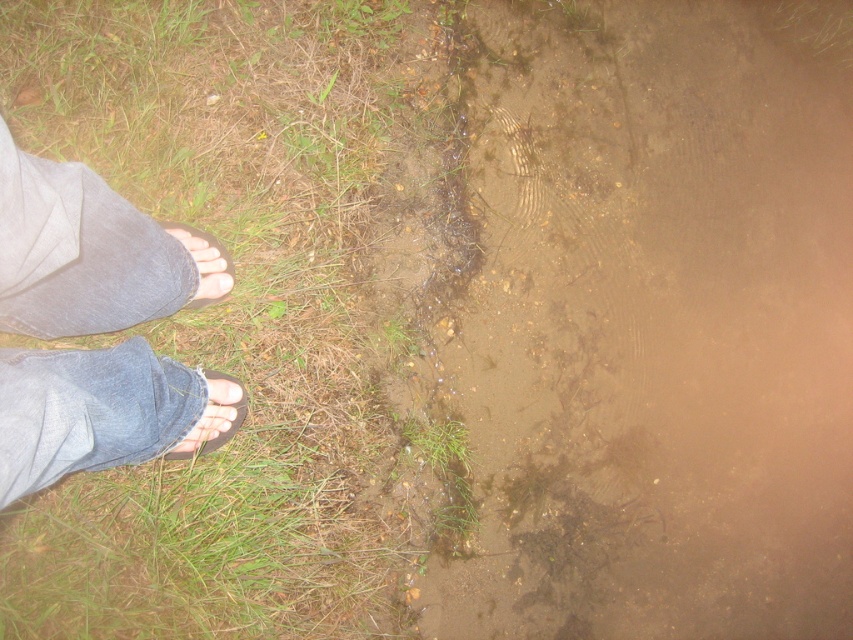
Question: Which point appears closest to the camera in this image?

Choices:
 (A) (136, 54)
 (B) (613, 416)

Answer: (A)

Question: Is the position of brown muddy water at lower left less distant than that of denim sandal at lower left?

Choices:
 (A) yes
 (B) no

Answer: (B)

Question: Among these points, which one is nearest to the camera?

Choices:
 (A) (747, 54)
 (B) (231, 426)
 (C) (67, 176)
 (D) (228, 269)

Answer: (C)

Question: Which point appears farthest from the camera in this image?

Choices:
 (A) (207, 448)
 (B) (312, 481)

Answer: (B)

Question: Does green grass at lower left appear on the left side of denim sandal at lower left?

Choices:
 (A) no
 (B) yes

Answer: (A)

Question: Is brown muddy water at lower left wider than brown leather sandal at lower left?

Choices:
 (A) no
 (B) yes

Answer: (B)